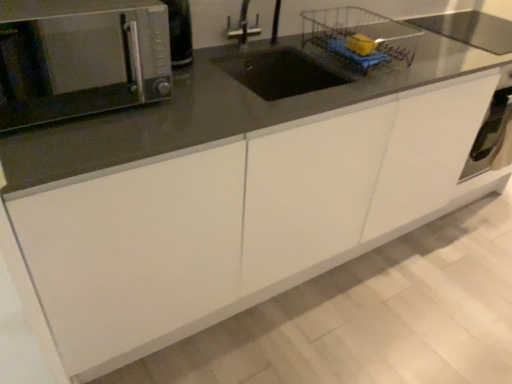
Image resolution: width=512 pixels, height=384 pixels. Find the location of `satin silver oven at lower right`. satin silver oven at lower right is located at coordinates (489, 135).

The height and width of the screenshot is (384, 512). In order to click on yellow sponge at upper right in this screenshot , I will do `click(361, 44)`.

Where is `satin silver microwave at upper left`? This screenshot has height=384, width=512. satin silver microwave at upper left is located at coordinates (80, 58).

From a real-world perspective, is yellow sponge at upper right physically below wire mesh basket at upper center?

No.

Is yellow sponge at upper right oriented towards wire mesh basket at upper center?

Yes, yellow sponge at upper right is oriented towards wire mesh basket at upper center.

Considering the sizes of yellow sponge at upper right and wire mesh basket at upper center in the image, is yellow sponge at upper right bigger or smaller than wire mesh basket at upper center?

Considering their sizes, yellow sponge at upper right takes up less space than wire mesh basket at upper center.

Is satin silver oven at lower right at the back of wire mesh basket at upper center?

That's not correct — wire mesh basket at upper center is not looking away from satin silver oven at lower right.

Considering the sizes of wire mesh basket at upper center and satin silver oven at lower right in the image, is wire mesh basket at upper center taller or shorter than satin silver oven at lower right?

Clearly, wire mesh basket at upper center is shorter compared to satin silver oven at lower right.

Where is `oven directly beneath the wire mesh basket at upper center (from a real-world perspective)`? The width and height of the screenshot is (512, 384). oven directly beneath the wire mesh basket at upper center (from a real-world perspective) is located at coordinates (489, 135).

Between point (360, 66) and point (472, 151), which one is positioned behind?

The point (472, 151) is more distant.

From a real-world perspective, who is located lower, satin silver oven at lower right or wire mesh basket at upper center?

satin silver oven at lower right is physically lower.

Is satin silver oven at lower right turned away from wire mesh basket at upper center?

No, wire mesh basket at upper center is not at the back of satin silver oven at lower right.

From the image's perspective, is satin silver oven at lower right on wire mesh basket at upper center?

No.

Is satin silver oven at lower right wider or thinner than wire mesh basket at upper center?

Clearly, satin silver oven at lower right has less width compared to wire mesh basket at upper center.

Could yellow sponge at upper right be considered to be inside satin silver oven at lower right?

No, yellow sponge at upper right is located outside of satin silver oven at lower right.

Between satin silver oven at lower right and yellow sponge at upper right, which one has more height?

With more height is satin silver oven at lower right.

How far apart are satin silver oven at lower right and yellow sponge at upper right?

satin silver oven at lower right is 33.25 inches away from yellow sponge at upper right.

In the scene shown: Is satin silver oven at lower right oriented away from yellow sponge at upper right?

No.

Is yellow sponge at upper right shorter than satin silver microwave at upper left?

Indeed, yellow sponge at upper right has a lesser height compared to satin silver microwave at upper left.

Is the surface of yellow sponge at upper right in direct contact with satin silver microwave at upper left?

They are not placed beside each other.

In the scene shown: Is yellow sponge at upper right oriented away from satin silver microwave at upper left?

That's not correct — yellow sponge at upper right is not looking away from satin silver microwave at upper left.

Is satin silver microwave at upper left surrounded by yellow sponge at upper right?

That's incorrect, satin silver microwave at upper left is not inside yellow sponge at upper right.

From a real-world perspective, does satin silver oven at lower right sit lower than satin silver microwave at upper left?

Correct, in the physical world, satin silver oven at lower right is lower than satin silver microwave at upper left.

Considering the sizes of satin silver oven at lower right and satin silver microwave at upper left in the image, is satin silver oven at lower right wider or thinner than satin silver microwave at upper left?

satin silver oven at lower right is thinner than satin silver microwave at upper left.

Based on the photo, could you tell me if satin silver oven at lower right is facing satin silver microwave at upper left?

No, satin silver oven at lower right does not turn towards satin silver microwave at upper left.

Image resolution: width=512 pixels, height=384 pixels. I want to click on microwave oven that appears on the left of satin silver oven at lower right, so click(x=80, y=58).

Would you consider satin silver microwave at upper left to be distant from satin silver oven at lower right?

Yes, satin silver microwave at upper left is far from satin silver oven at lower right.

In terms of height, does satin silver microwave at upper left look taller or shorter compared to satin silver oven at lower right?

Clearly, satin silver microwave at upper left is shorter compared to satin silver oven at lower right.

Which object is positioned more to the left, satin silver microwave at upper left or satin silver oven at lower right?

Positioned to the left is satin silver microwave at upper left.

Is satin silver microwave at upper left closer to the viewer compared to satin silver oven at lower right?

That is True.

Where is `basket that appears above the yellow sponge at upper right (from the image's perspective)`? basket that appears above the yellow sponge at upper right (from the image's perspective) is located at coordinates (360, 37).

Where is `oven that is under the wire mesh basket at upper center (from a real-world perspective)`? oven that is under the wire mesh basket at upper center (from a real-world perspective) is located at coordinates (489, 135).

Estimate the real-world distances between objects in this image. Which object is closer to yellow sponge at upper right, satin silver microwave at upper left or satin silver oven at lower right?

Among the two, satin silver oven at lower right is located nearer to yellow sponge at upper right.

Estimate the real-world distances between objects in this image. Which object is further from wire mesh basket at upper center, satin silver oven at lower right or yellow sponge at upper right?

Based on the image, satin silver oven at lower right appears to be further to wire mesh basket at upper center.

When comparing their distances from yellow sponge at upper right, does satin silver oven at lower right or wire mesh basket at upper center seem further?

satin silver oven at lower right lies further to yellow sponge at upper right than the other object.

In the scene shown: Looking at the image, which one is located closer to satin silver oven at lower right, satin silver microwave at upper left or yellow sponge at upper right?

yellow sponge at upper right.

Based on their spatial positions, is satin silver oven at lower right or satin silver microwave at upper left further from wire mesh basket at upper center?

Among the two, satin silver microwave at upper left is located further to wire mesh basket at upper center.

Looking at this image, which object lies nearer to the anchor point satin silver oven at lower right, yellow sponge at upper right or satin silver microwave at upper left?

yellow sponge at upper right is positioned closer to the anchor satin silver oven at lower right.

Based on their spatial positions, is satin silver oven at lower right or satin silver microwave at upper left further from yellow sponge at upper right?

The object further to yellow sponge at upper right is satin silver microwave at upper left.

Based on their spatial positions, is yellow sponge at upper right or satin silver oven at lower right closer to wire mesh basket at upper center?

yellow sponge at upper right lies closer to wire mesh basket at upper center than the other object.

Locate an element on the screen. The width and height of the screenshot is (512, 384). food between satin silver microwave at upper left and wire mesh basket at upper center from left to right is located at coordinates (361, 44).

In order to click on basket between satin silver microwave at upper left and satin silver oven at lower right in this screenshot , I will do `click(360, 37)`.

You are a GUI agent. You are given a task and a screenshot of the screen. Output one action in this format:
    pyautogui.click(x=<x>, y=<y>)
    Task: Click on the basket between yellow sponge at upper right and satin silver oven at lower right in the horizontal direction
    Image resolution: width=512 pixels, height=384 pixels.
    Given the screenshot: What is the action you would take?
    pyautogui.click(x=360, y=37)

Identify the location of food between satin silver microwave at upper left and satin silver oven at lower right from left to right. The height and width of the screenshot is (384, 512). (361, 44).